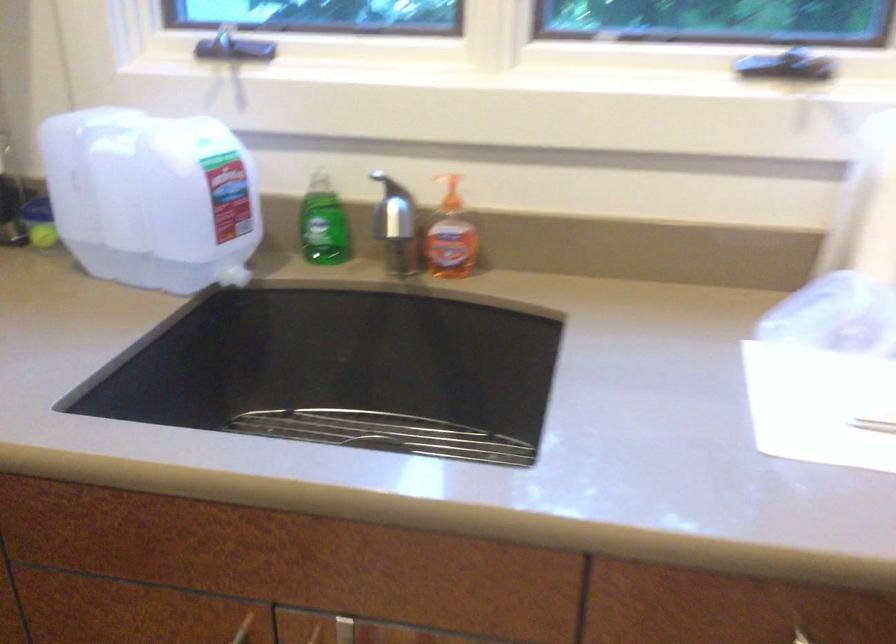
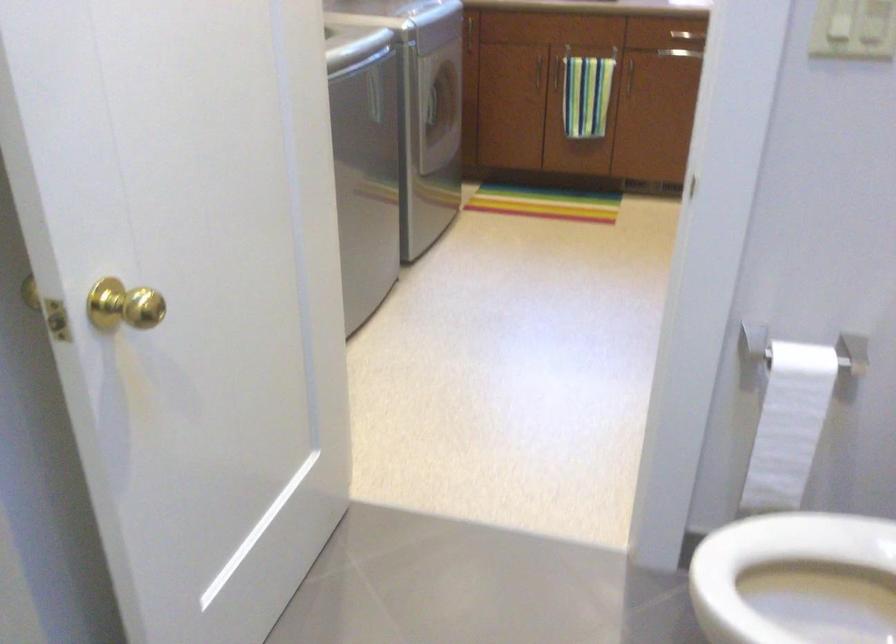
Question: The images are taken continuously from a first-person perspective. In which direction are you moving?

Choices:
 (A) Left
 (B) Right
 (C) Forward
 (D) Backward

Answer: (D)